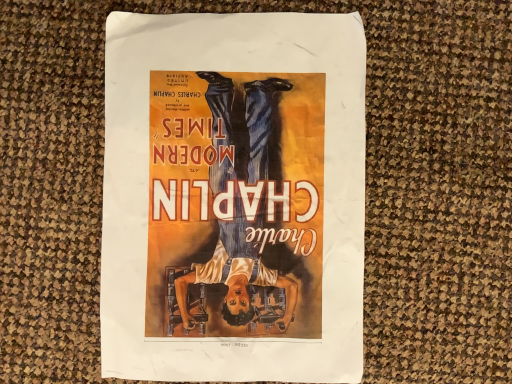
What do you see at coordinates (233, 197) in the screenshot? I see `matte paper poster at center` at bounding box center [233, 197].

I want to click on matte paper poster at center, so [233, 197].

Find the location of a particular element. The height and width of the screenshot is (384, 512). matte paper poster at center is located at coordinates (233, 197).